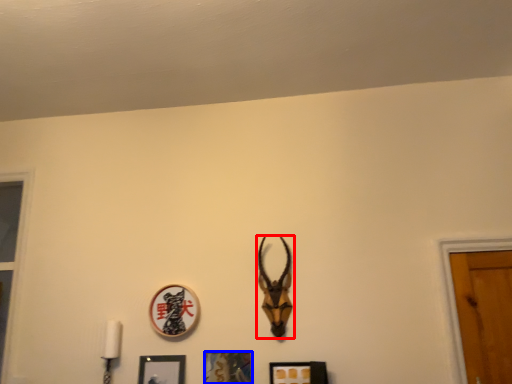
Question: Which of the following is the farthest to the observer, antelope (highlighted by a red box) or picture frame (highlighted by a blue box)?

Choices:
 (A) antelope
 (B) picture frame

Answer: (A)